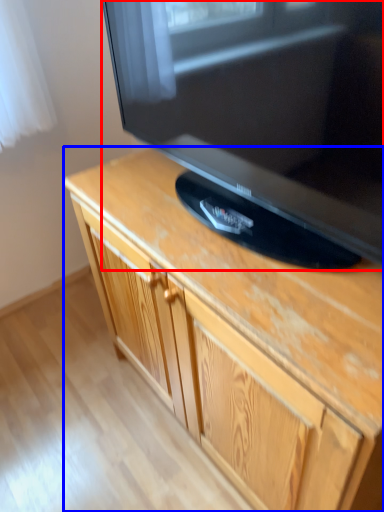
Question: Which point is closer to the camera, television (highlighted by a red box) or cabinetry (highlighted by a blue box)?

Choices:
 (A) television
 (B) cabinetry

Answer: (A)